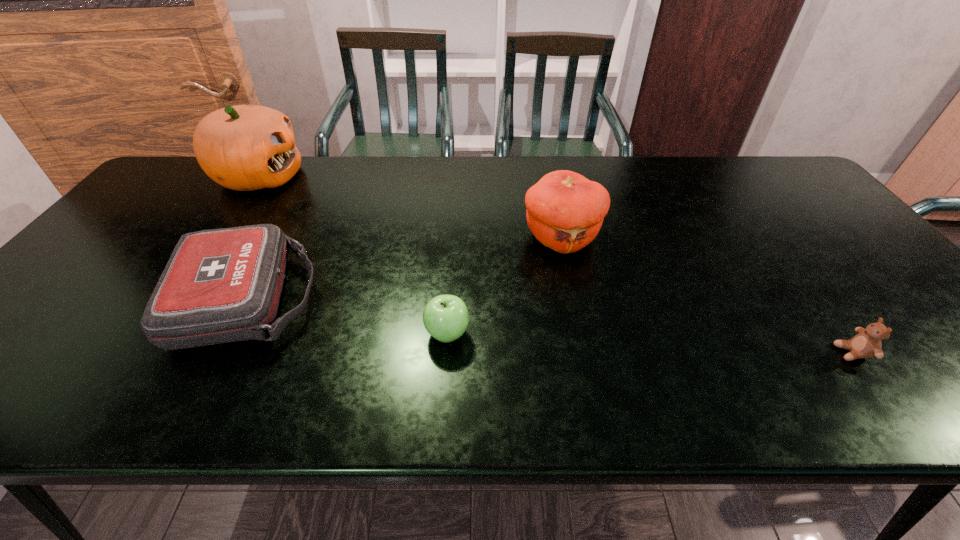
Identify the location of vacant area located 0.160m on the back of the apple. (451, 268).

Where is `vacant area situated on the front-facing side of the rightmost object`? vacant area situated on the front-facing side of the rightmost object is located at coordinates (705, 353).

Locate an element on the screen. This screenshot has width=960, height=540. vacant area located on the front-facing side of the rightmost object is located at coordinates (804, 353).

I want to click on vacant point located 0.300m on the front-facing side of the rightmost object, so click(x=695, y=353).

Find the location of a particular element. object positioned at the far edge is located at coordinates (244, 147).

Where is `vacant space at the far edge of the desktop`? Image resolution: width=960 pixels, height=540 pixels. vacant space at the far edge of the desktop is located at coordinates (627, 164).

This screenshot has width=960, height=540. In the image, there is a desktop. In order to click on free space at the left edge in this screenshot , I will do `click(126, 249)`.

Locate an element on the screen. vacant space at the far left corner of the desktop is located at coordinates (182, 183).

In the image, there is a desktop. At what (x,y) coordinates should I click in order to perform the action: click on free region at the near left corner. Please return your answer as a coordinate pair (x, y). The width and height of the screenshot is (960, 540). Looking at the image, I should click on (36, 378).

Identify the location of unoccupied position between the rightmost object and the apple. (650, 343).